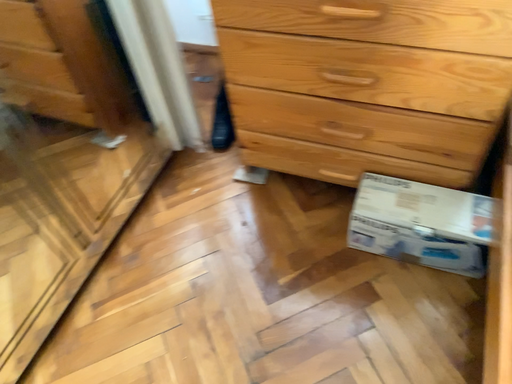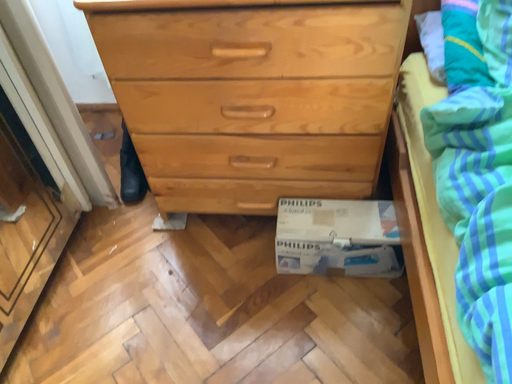
Question: How did the camera likely rotate when shooting the video?

Choices:
 (A) rotated downward
 (B) rotated upward

Answer: (B)